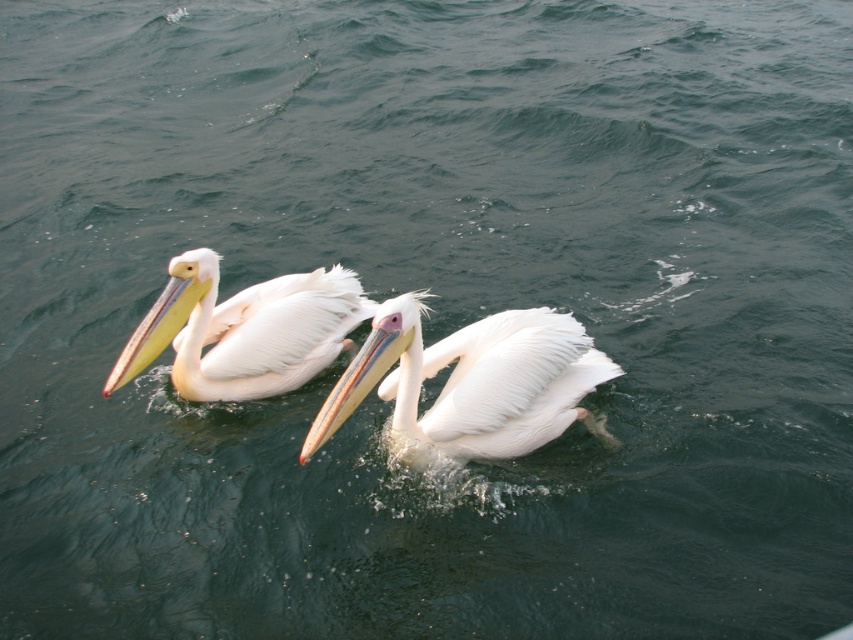
Question: Does white feathered pelican at center have a greater width compared to white matte pelican at left?

Choices:
 (A) yes
 (B) no

Answer: (A)

Question: In this image, where is white feathered pelican at center located relative to white matte pelican at left?

Choices:
 (A) above
 (B) below

Answer: (B)

Question: Which object appears farthest from the camera in this image?

Choices:
 (A) white feathered pelican at center
 (B) white matte pelican at left

Answer: (B)

Question: Is white feathered pelican at center bigger than white matte pelican at left?

Choices:
 (A) yes
 (B) no

Answer: (A)